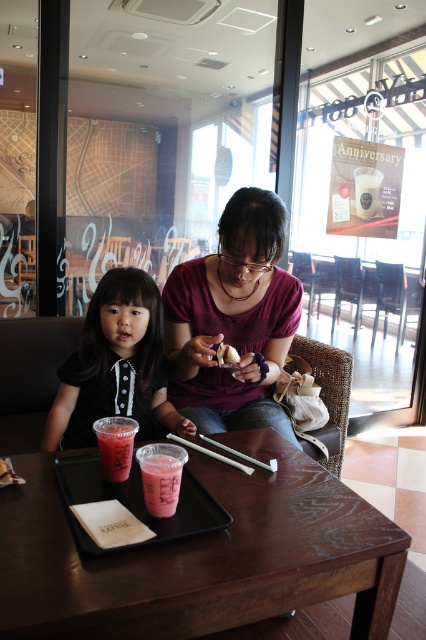
You are a customer at this table and want to choose the taller cup for your drink. Which cup should you pick between the pink matte plastic cup at lower center and the matte plastic cup at upper right?

The matte plastic cup at upper right is taller than the pink matte plastic cup at lower center, so you should pick the matte plastic cup at upper right.

You are sitting at the table in the image. You want to reach the point at coordinates point (x=155, y=465) and point (x=359, y=193). Which coordinate is closer to you?

Point (x=155, y=465) is in front of point (x=359, y=193), so it is closer to you.